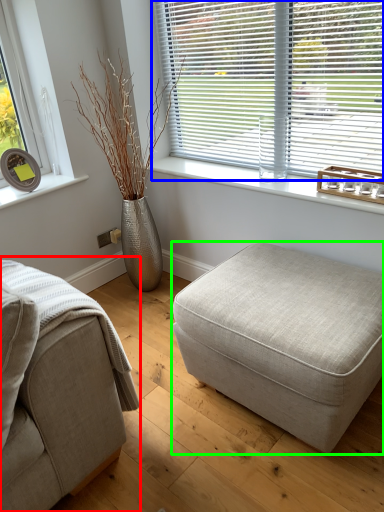
Question: Which is farther away from studio couch (highlighted by a red box)? window blind (highlighted by a blue box) or stool (highlighted by a green box)?

Choices:
 (A) window blind
 (B) stool

Answer: (A)